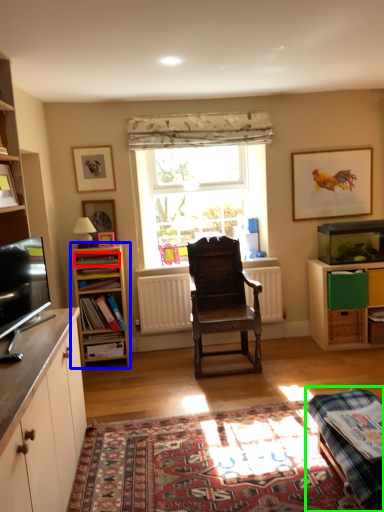
Question: Considering the real-world distances, which object is closest to book (highlighted by a red box)? shelf (highlighted by a blue box) or table (highlighted by a green box).

Choices:
 (A) shelf
 (B) table

Answer: (A)